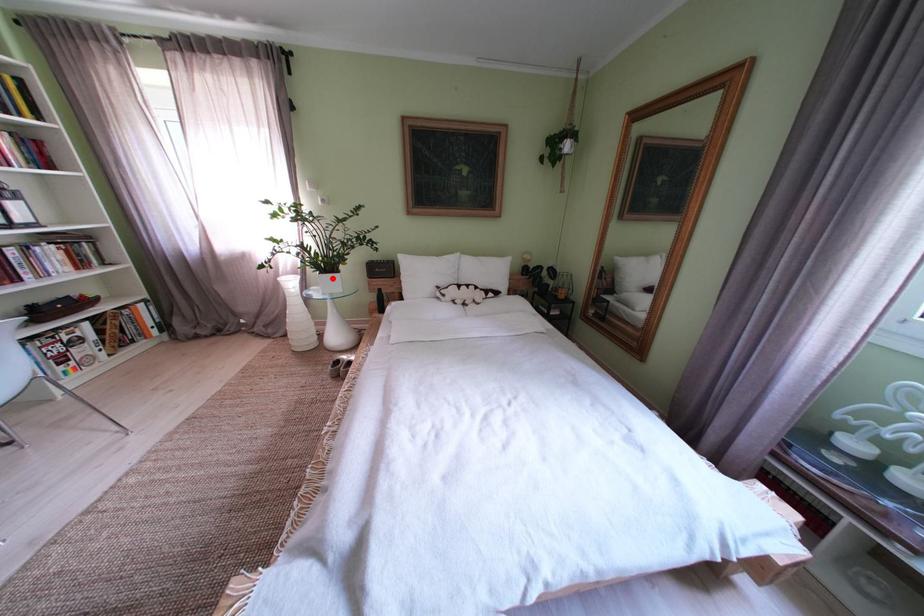
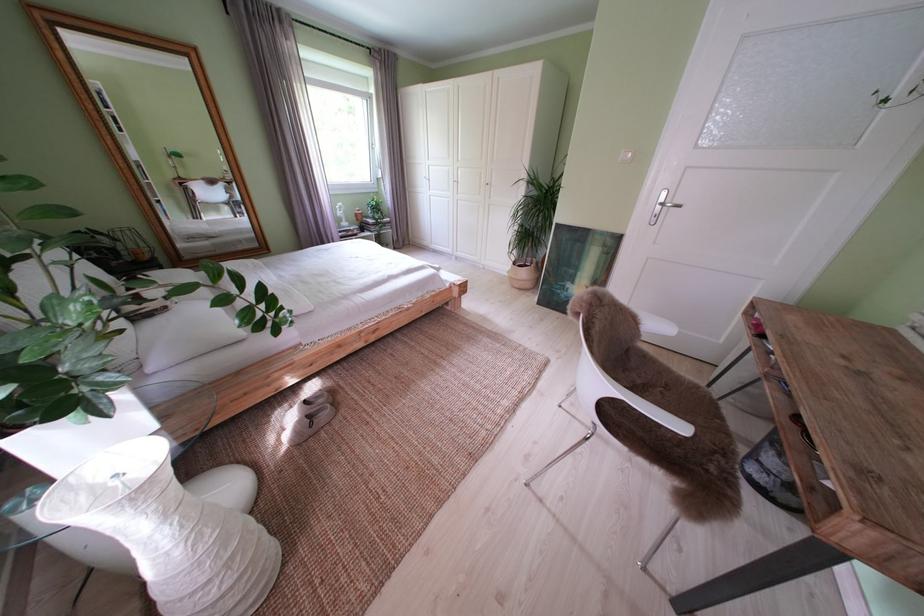
Question: A red point is marked in image1. In image2, is the corresponding 3D point closer to the camera or farther? Reply with the corresponding letter.

Choices:
 (A) The corresponding 3D point is closer.
 (B) The corresponding 3D point is farther.

Answer: (B)